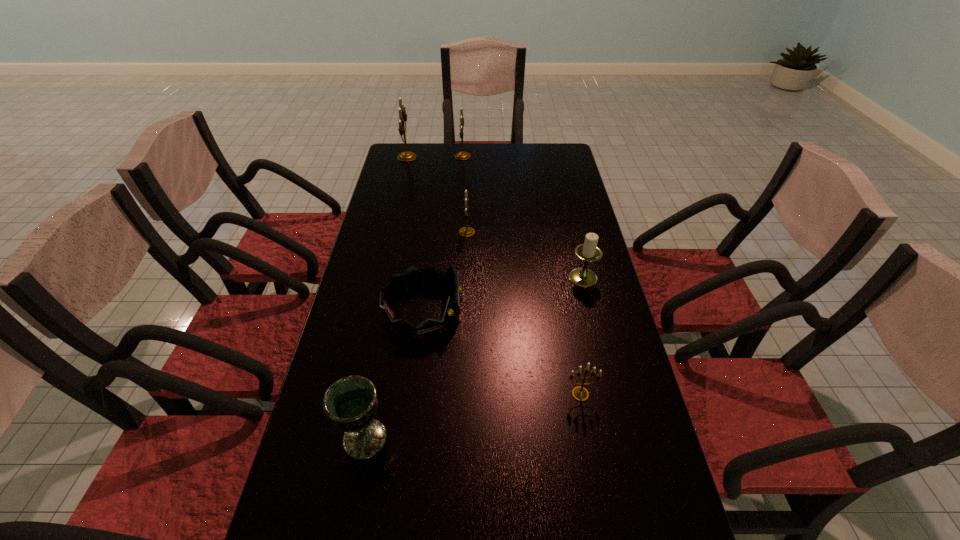
Image resolution: width=960 pixels, height=540 pixels. I want to click on tiara that is at the left edge, so click(413, 277).

Locate an element on the screen. The height and width of the screenshot is (540, 960). object that is positioned at the far left corner is located at coordinates (406, 156).

In the image, there is a desktop. Identify the location of vacant area at the far edge. The image size is (960, 540). (475, 152).

The image size is (960, 540). What are the coordinates of `free spot at the left edge of the desktop` in the screenshot? It's located at (385, 346).

Identify the location of free space at the right edge. (572, 243).

This screenshot has height=540, width=960. I want to click on free space between the biggest gold candelabrum and the tiara, so click(415, 234).

Identify the location of free space that is in between the fourth farthest candelabrum and the second biggest gold candelabrum. (523, 217).

Find the location of a particular element. vacant space in between the third smallest gold candelabrum and the shortest object is located at coordinates tap(521, 275).

Find the location of a particular element. empty space that is in between the second nearest object and the third farthest candelabrum is located at coordinates (524, 313).

The height and width of the screenshot is (540, 960). I want to click on vacant area between the tiara and the fourth farthest candelabrum, so click(503, 295).